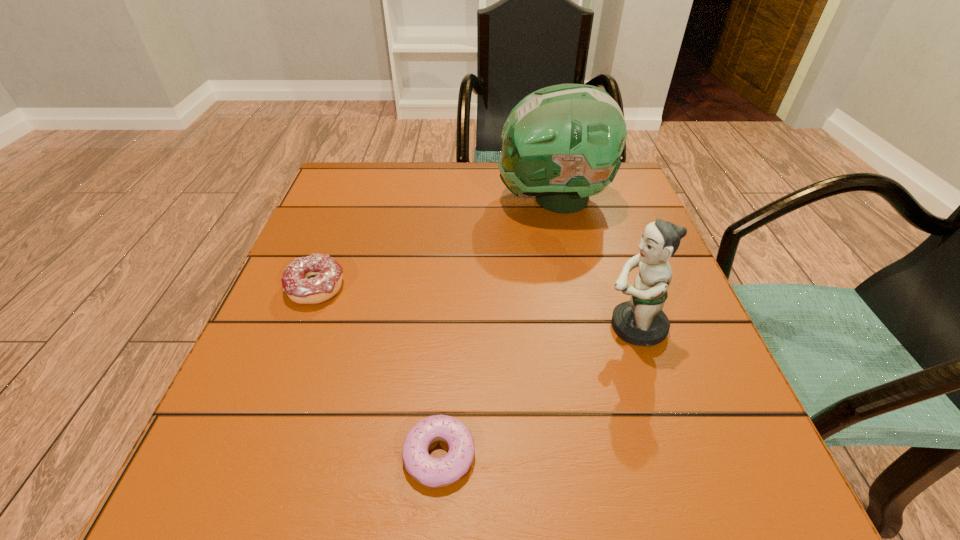
Where is `object present at the far right corner`? object present at the far right corner is located at coordinates (562, 143).

This screenshot has width=960, height=540. In the image, there is a desktop. What are the coordinates of `vacant space at the far edge` in the screenshot? It's located at (498, 203).

In the image, there is a desktop. At what (x,y) coordinates should I click in order to perform the action: click on vacant space at the near edge. Please return your answer as a coordinate pair (x, y). The image size is (960, 540). Looking at the image, I should click on (342, 455).

This screenshot has width=960, height=540. Find the location of `vacant space at the left edge of the desktop`. vacant space at the left edge of the desktop is located at coordinates (300, 252).

In the image, there is a desktop. In order to click on free space at the right edge in this screenshot , I will do `click(606, 265)`.

Image resolution: width=960 pixels, height=540 pixels. Identify the location of vacant space at the far left corner of the desktop. (383, 197).

The image size is (960, 540). I want to click on unoccupied area between the leftmost object and the third shortest object, so click(x=475, y=307).

You are a GUI agent. You are given a task and a screenshot of the screen. Output one action in this format:
    pyautogui.click(x=<x>, y=<y>)
    Task: Click on the free spot between the farther doughnut and the football helmet
    The image size is (960, 540).
    Given the screenshot: What is the action you would take?
    pyautogui.click(x=434, y=244)

Identify the location of vacant area that lies between the tallest object and the nearer doughnut. (496, 327).

What are the coordinates of `free space between the right doughnut and the second shortest object` in the screenshot? It's located at (377, 371).